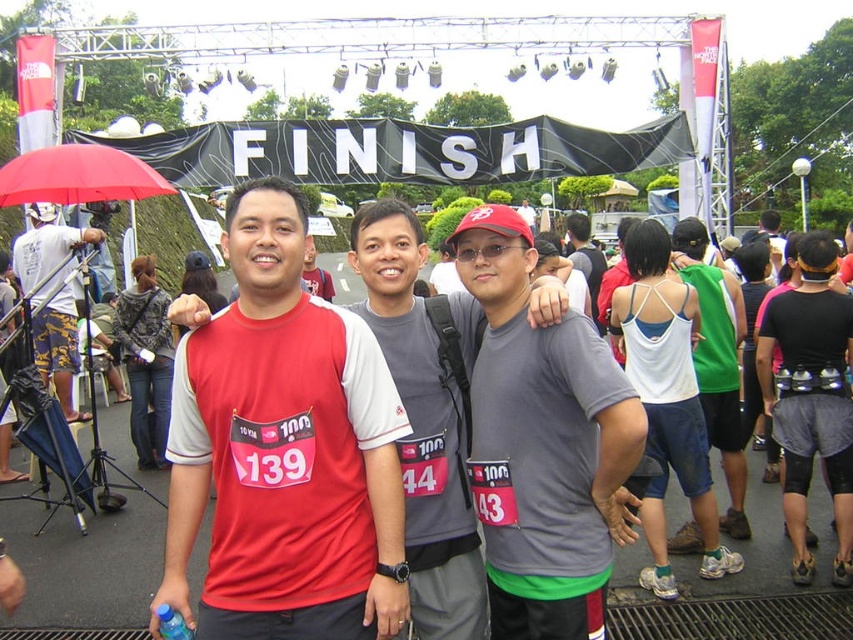
Is matte red t-shirt at center closer to the viewer compared to white fabric umbrella at left?

Yes, it is.

Does point (338, 518) lie in front of point (67, 237)?

Yes, point (338, 518) is in front of point (67, 237).

Identify the location of matte red t-shirt at center. (283, 449).

I want to click on matte red t-shirt at center, so click(x=283, y=449).

Does matte red t-shirt at center appear on the right side of white cotton tank top at center?

In fact, matte red t-shirt at center is to the left of white cotton tank top at center.

From the picture: Between matte red t-shirt at center and white cotton tank top at center, which one is positioned higher?

white cotton tank top at center

This screenshot has height=640, width=853. What do you see at coordinates (283, 449) in the screenshot?
I see `matte red t-shirt at center` at bounding box center [283, 449].

Identify the location of matte red t-shirt at center. This screenshot has height=640, width=853. (283, 449).

Does gray matte t-shirt at center have a smaller size compared to matte gray t-shirt at center?

Incorrect, gray matte t-shirt at center is not smaller in size than matte gray t-shirt at center.

I want to click on gray matte t-shirt at center, so click(543, 444).

The height and width of the screenshot is (640, 853). What do you see at coordinates (543, 444) in the screenshot?
I see `gray matte t-shirt at center` at bounding box center [543, 444].

This screenshot has width=853, height=640. What are the coordinates of `gray matte t-shirt at center` in the screenshot? It's located at (543, 444).